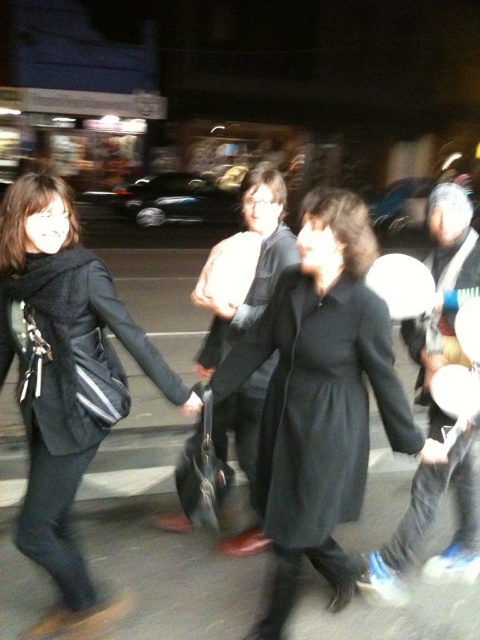
Question: Where is matte black coat at left located in relation to white matte hat at center in the image?

Choices:
 (A) left
 (B) right

Answer: (A)

Question: Which of the following is the farthest from the observer?

Choices:
 (A) black matte coat at center
 (B) matte black coat at left
 (C) white matte hat at center
 (D) black fabric coat at center

Answer: (D)

Question: Can you confirm if matte black coat at left is positioned below white matte hat at center?

Choices:
 (A) no
 (B) yes

Answer: (B)

Question: Among these objects, which one is nearest to the camera?

Choices:
 (A) matte black coat at left
 (B) black matte coat at center
 (C) black fabric coat at center
 (D) white matte hat at center

Answer: (B)

Question: Does white matte hat at center have a lesser width compared to black fabric coat at center?

Choices:
 (A) yes
 (B) no

Answer: (B)

Question: Which of the following is the farthest from the observer?

Choices:
 (A) (41, 326)
 (B) (282, 205)
 (C) (474, 570)
 (D) (333, 560)

Answer: (C)